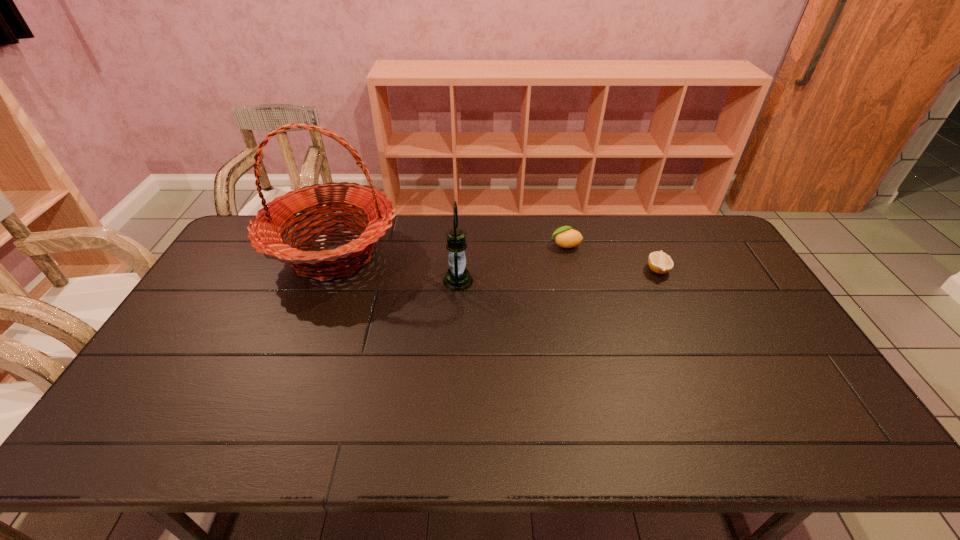
The width and height of the screenshot is (960, 540). In order to click on the leftmost object in this screenshot , I will do `click(265, 233)`.

Image resolution: width=960 pixels, height=540 pixels. Find the location of `basket`. basket is located at coordinates (265, 233).

Locate an element on the screen. The height and width of the screenshot is (540, 960). the second tallest object is located at coordinates click(457, 278).

The image size is (960, 540). Find the location of `lantern`. lantern is located at coordinates (457, 278).

Locate an element on the screen. This screenshot has height=540, width=960. the taller lemon is located at coordinates (565, 237).

Find the location of `the farther lemon`. the farther lemon is located at coordinates (565, 237).

Locate an element on the screen. The image size is (960, 540). the rightmost object is located at coordinates (659, 262).

Locate an element on the screen. The width and height of the screenshot is (960, 540). the shorter lemon is located at coordinates (659, 262).

Where is `vacant space located on the front of the basket`? vacant space located on the front of the basket is located at coordinates (310, 313).

What are the coordinates of `vacant space positioned on the side where the third object from right to left emits light` in the screenshot? It's located at (564, 281).